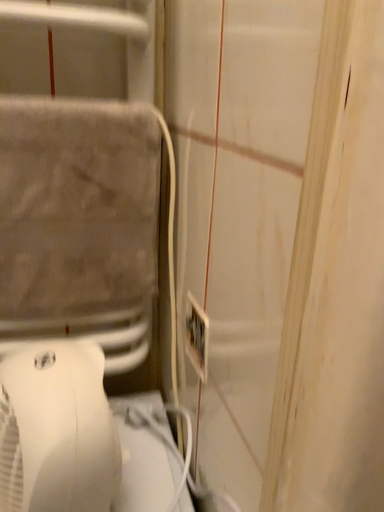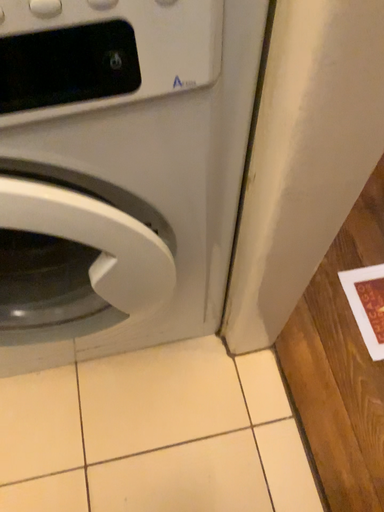
Question: Which way did the camera rotate in the video?

Choices:
 (A) rotated upward
 (B) rotated downward

Answer: (B)